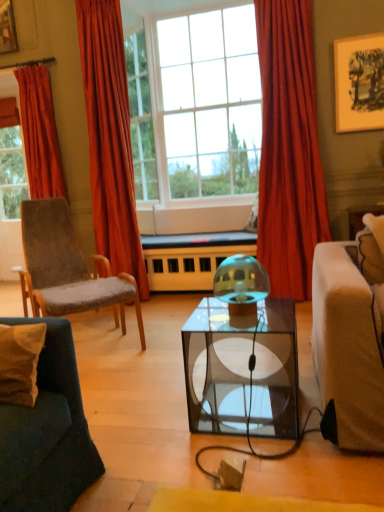
Identify the location of vacant space in front of transparent glass coffee table at center. (262, 466).